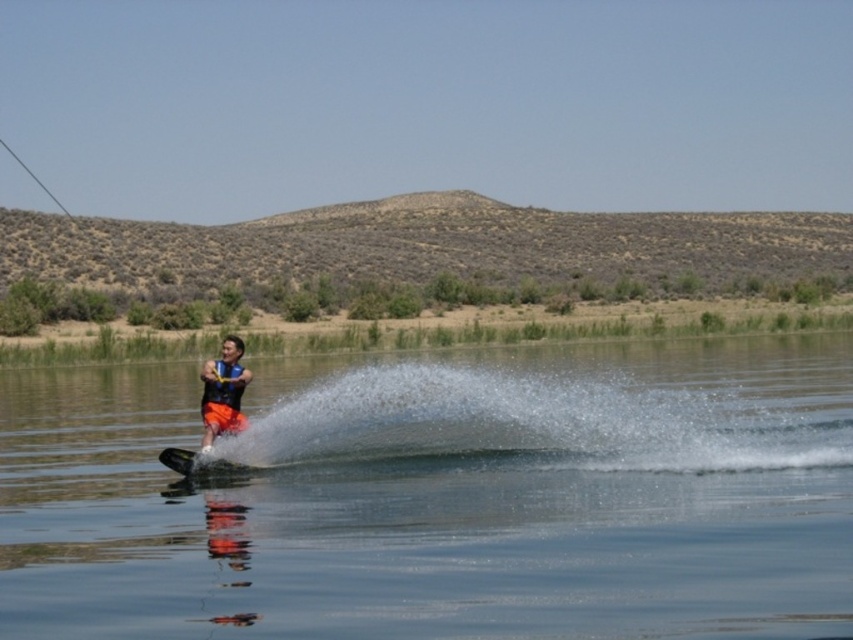
You are a safety inspector checking the water skiing setup. Based on the scene, can you confirm if the black matte water ski at lower center is fully submerged in the clear water at center?

The clear water at center is above the black matte water ski at lower center, which means the water ski is submerged in the water.